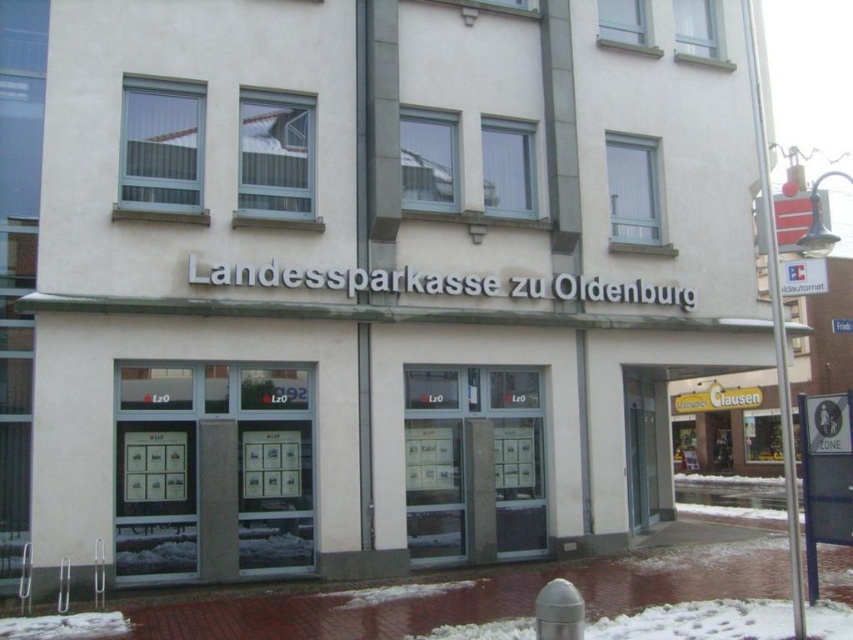
Question: Is transparent glass windows at center positioned before transparent glass doors at center?

Choices:
 (A) no
 (B) yes

Answer: (B)

Question: Is transparent glass windows at center below transparent glass doors at center?

Choices:
 (A) no
 (B) yes

Answer: (A)

Question: Is transparent glass windows at center wider than transparent glass doors at center?

Choices:
 (A) no
 (B) yes

Answer: (B)

Question: Which point is closer to the camera?

Choices:
 (A) transparent glass doors at center
 (B) transparent glass windows at center

Answer: (B)

Question: Among these points, which one is farthest from the camera?

Choices:
 (A) (415, 531)
 (B) (149, 572)

Answer: (A)

Question: Which of the following is the farthest from the observer?

Choices:
 (A) transparent glass doors at center
 (B) transparent glass windows at center

Answer: (A)